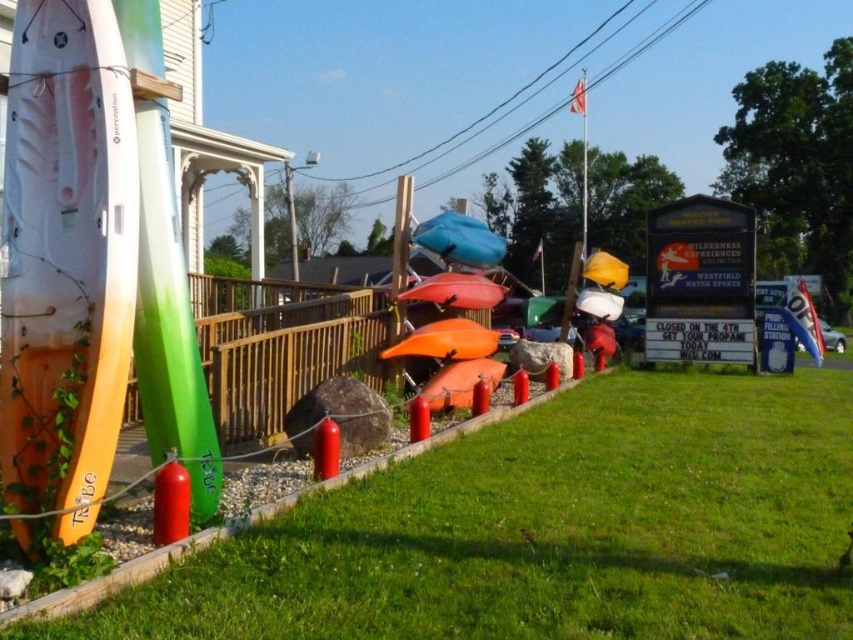
Based on the scene description, where is the green grass at lower center located in terms of its 2D coordinates?

The green grass at lower center is located at the 2D coordinates of point [550,531].

You are standing at the point with coordinates point (67, 259). What object are you standing on?

You are standing on the white matte surfboard at left.

You are standing on the gravel path and want to pick up the white matte surfboard at left and the orange matte kayak at center. Which object is closer to you?

The white matte surfboard at left is closer to you because it is in front of the orange matte kayak at center.